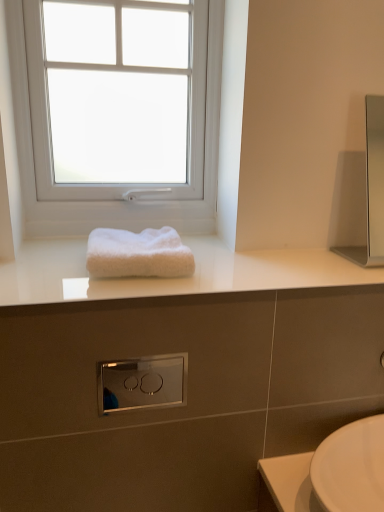
Image resolution: width=384 pixels, height=512 pixels. I want to click on white glossy towel at center, so click(x=174, y=278).

Between white fluffy towel at center and white glossy towel at center, which one has smaller width?

white fluffy towel at center is thinner.

Is white fluffy towel at center positioned behind white glossy towel at center?

Yes, it is.

Image resolution: width=384 pixels, height=512 pixels. I want to click on countertop in front of the white fluffy towel at center, so click(x=174, y=278).

Consider the image. From a real-world perspective, is white fluffy towel at center below white glossy towel at center?

No, from a real-world perspective, white fluffy towel at center is not under white glossy towel at center.

Measure the distance between satin chrome switch at center and white plastic window at upper center.

satin chrome switch at center and white plastic window at upper center are 3.97 feet apart from each other.

From the image's perspective, is satin chrome switch at center located above white plastic window at upper center?

Incorrect, from the image's perspective, satin chrome switch at center is lower than white plastic window at upper center.

How many degrees apart are the facing directions of satin chrome switch at center and white plastic window at upper center?

There is a 0.344-degree angle between the facing directions of satin chrome switch at center and white plastic window at upper center.

Between point (136, 404) and point (86, 226), which one is positioned behind?

The point (136, 404) is farther from the camera.

From the image's perspective, is white fluffy towel at center located above satin silver medicine cabinet at right?

No, from the image's perspective, white fluffy towel at center is not over satin silver medicine cabinet at right.

Considering the positions of objects white fluffy towel at center and satin silver medicine cabinet at right in the image provided, who is more to the left, white fluffy towel at center or satin silver medicine cabinet at right?

From the viewer's perspective, white fluffy towel at center appears more on the left side.

The image size is (384, 512). Identify the location of medicine cabinet located above the white fluffy towel at center (from the image's perspective). (372, 189).

Which is correct: white plastic window at upper center is inside white glossy towel at center, or outside of it?

white plastic window at upper center exists outside the volume of white glossy towel at center.

Between white plastic window at upper center and white glossy towel at center, which one appears on the left side from the viewer's perspective?

white plastic window at upper center.

Which is behind, point (45, 227) or point (85, 276)?

The point (45, 227) is more distant.

Between white plastic window at upper center and satin chrome switch at center, which one has smaller width?

A: Thinner between the two is satin chrome switch at center.

How different are the orientations of white plastic window at upper center and satin chrome switch at center in degrees?

The facing directions of white plastic window at upper center and satin chrome switch at center are 0.344 degrees apart.

Does white plastic window at upper center have a greater height compared to satin chrome switch at center?

Yes, white plastic window at upper center is taller than satin chrome switch at center.

Locate an element on the screen. This screenshot has width=384, height=512. electric outlet below the white plastic window at upper center (from the image's perspective) is located at coordinates tap(142, 383).

From the image's perspective, which one is positioned lower, satin chrome switch at center or satin silver medicine cabinet at right?

satin chrome switch at center appears lower in the image.

Based on the photo, is satin chrome switch at center far away from satin silver medicine cabinet at right?

Yes, satin chrome switch at center and satin silver medicine cabinet at right are located far from each other.

Is satin chrome switch at center looking in the opposite direction of satin silver medicine cabinet at right?

No.

Is satin chrome switch at center smaller than satin silver medicine cabinet at right?

Yes.

Is white glossy towel at center surrounding satin chrome switch at center?

No, satin chrome switch at center is not inside white glossy towel at center.

From the picture: Can you tell me how much white glossy towel at center and satin chrome switch at center differ in facing direction?

The angular difference between white glossy towel at center and satin chrome switch at center is 0.537 degrees.

Is white glossy towel at center turned away from satin chrome switch at center?

No, white glossy towel at center is not facing away from satin chrome switch at center.

Is the depth of white glossy towel at center less than that of satin chrome switch at center?

Yes.

You are a GUI agent. You are given a task and a screenshot of the screen. Output one action in this format:
    pyautogui.click(x=<x>, y=<y>)
    Task: Click on the countertop below the white fluffy towel at center (from the image's perspective)
    This screenshot has height=512, width=384.
    Given the screenshot: What is the action you would take?
    [174, 278]

You are a GUI agent. You are given a task and a screenshot of the screen. Output one action in this format:
    pyautogui.click(x=<x>, y=<y>)
    Task: Click on the window that appears behind the satin chrome switch at center
    
    Given the screenshot: What is the action you would take?
    pyautogui.click(x=110, y=201)

Looking at the image, which one is located further to white fluffy towel at center, white plastic window at upper center or satin chrome switch at center?

Based on the image, satin chrome switch at center appears to be further to white fluffy towel at center.

When comparing their distances from white fluffy towel at center, does satin chrome switch at center or white glossy towel at center seem further?

satin chrome switch at center lies further to white fluffy towel at center than the other object.

Estimate the real-world distances between objects in this image. Which object is closer to white fluffy towel at center, satin chrome switch at center or white plastic window at upper center?

white plastic window at upper center lies closer to white fluffy towel at center than the other object.

From the picture: Which object lies nearer to the anchor point white fluffy towel at center, satin silver medicine cabinet at right or white plastic window at upper center?

white plastic window at upper center.

Based on their spatial positions, is white fluffy towel at center or white plastic window at upper center further from white glossy towel at center?

The object further to white glossy towel at center is white plastic window at upper center.

Based on their spatial positions, is satin chrome switch at center or white fluffy towel at center closer to white glossy towel at center?

white fluffy towel at center is closer to white glossy towel at center.

Considering their positions, is satin chrome switch at center positioned closer to white fluffy towel at center than satin silver medicine cabinet at right?

satin silver medicine cabinet at right.

When comparing their distances from white plastic window at upper center, does white glossy towel at center or white fluffy towel at center seem closer?

Among the two, white fluffy towel at center is located nearer to white plastic window at upper center.

You are a GUI agent. You are given a task and a screenshot of the screen. Output one action in this format:
    pyautogui.click(x=<x>, y=<y>)
    Task: Click on the countertop between white fluffy towel at center and satin chrome switch at center from top to bottom
    
    Given the screenshot: What is the action you would take?
    pyautogui.click(x=174, y=278)

Locate an element on the screen. Image resolution: width=384 pixels, height=512 pixels. towel between white plastic window at upper center and white glossy towel at center in the vertical direction is located at coordinates (138, 254).

This screenshot has height=512, width=384. Find the location of `countertop between white plastic window at upper center and satin chrome switch at center in the vertical direction`. countertop between white plastic window at upper center and satin chrome switch at center in the vertical direction is located at coordinates (174, 278).

The image size is (384, 512). What are the coordinates of `towel between white plastic window at upper center and satin silver medicine cabinet at right` in the screenshot? It's located at (138, 254).